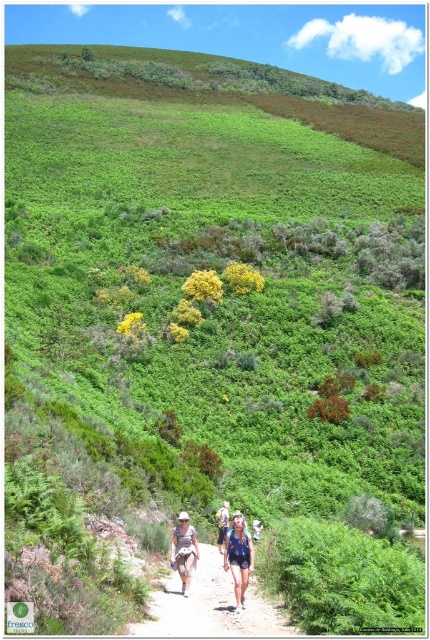
You are a hiker trying to decide which pair of shorts to wear for the trail. You see both the denim shorts at center and the camouflage fabric shorts at center in your backpack. Based on their positions in the image, which pair is more accessible to grab?

The denim shorts at center is positioned under camouflage fabric shorts at center, so the camouflage fabric shorts at center is more accessible to grab as it is on top.

You are a hiker trying to decide which direction to go next. You see two points on the path ahead marked as point 1 at coordinates (218, 564) and point 2 at (227, 513). Which point is closer to you?

Point 1 at coordinates (218, 564) is closer to you than point 2 at (227, 513).